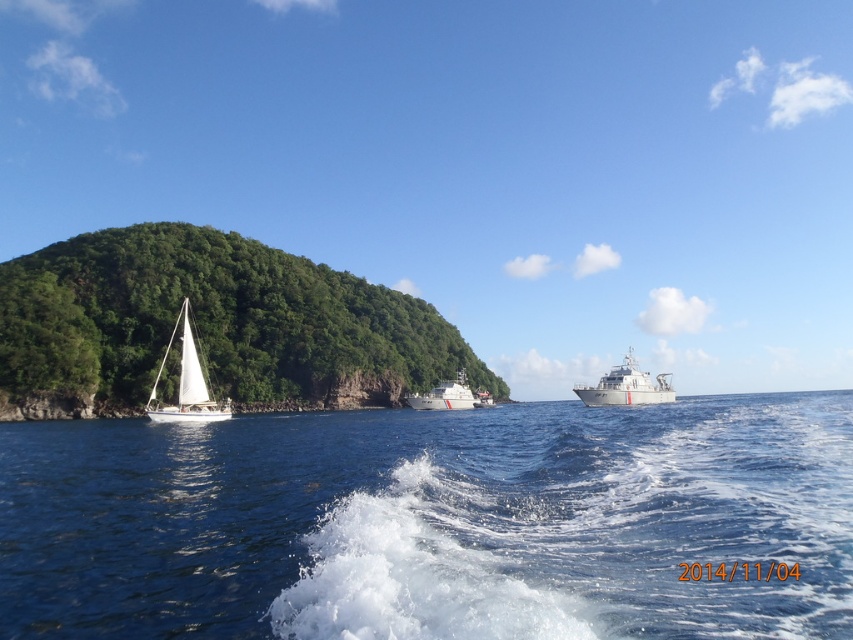
Question: Can you confirm if white sailboat at left is thinner than white glossy boat at center?

Choices:
 (A) no
 (B) yes

Answer: (A)

Question: Which point is farther to the camera?

Choices:
 (A) green leafy island at left
 (B) white glossy ship at center

Answer: (A)

Question: Which point is closer to the camera taking this photo?

Choices:
 (A) (389, 337)
 (B) (201, 372)

Answer: (B)

Question: Among these objects, which one is farthest from the camera?

Choices:
 (A) white glossy ship at center
 (B) green leafy island at left

Answer: (B)

Question: From the image, what is the correct spatial relationship of blue water at lower center in relation to white glossy ship at center?

Choices:
 (A) right
 (B) left

Answer: (B)

Question: Is white glossy ship at center above white glossy boat at center?

Choices:
 (A) no
 (B) yes

Answer: (B)